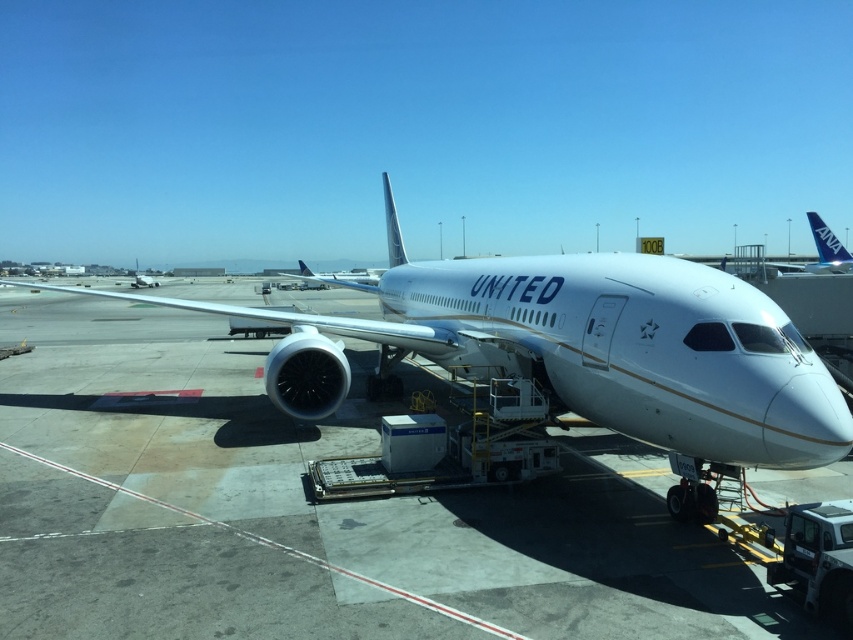
Question: Which object appears closest to the camera in this image?

Choices:
 (A) white matte airplane at center
 (B) white matte airplane at upper left
 (C) white glossy airplane at center
 (D) blue metallic airplane at upper right

Answer: (C)

Question: Which object is closer to the camera taking this photo?

Choices:
 (A) white matte airplane at center
 (B) blue metallic airplane at upper right

Answer: (B)

Question: Which point is farther from the camera taking this photo?

Choices:
 (A) (154, 285)
 (B) (370, 284)
 (C) (735, 348)
 (D) (817, 252)

Answer: (A)

Question: From the image, what is the correct spatial relationship of white glossy airplane at center in relation to white matte airplane at center?

Choices:
 (A) above
 (B) below

Answer: (B)

Question: Considering the relative positions of white glossy airplane at center and white matte airplane at center in the image provided, where is white glossy airplane at center located with respect to white matte airplane at center?

Choices:
 (A) below
 (B) above

Answer: (A)

Question: Does white glossy airplane at center have a smaller size compared to white matte airplane at center?

Choices:
 (A) no
 (B) yes

Answer: (B)